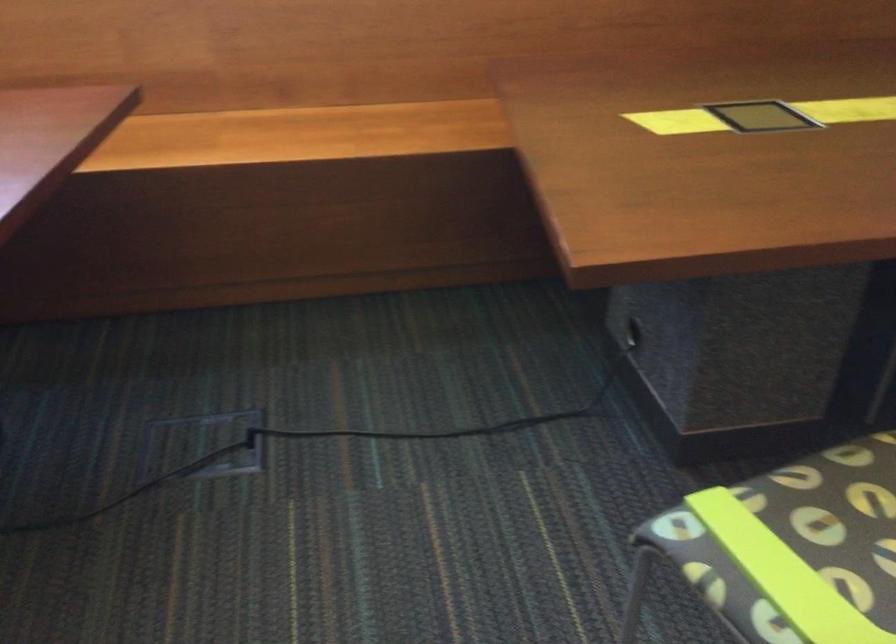
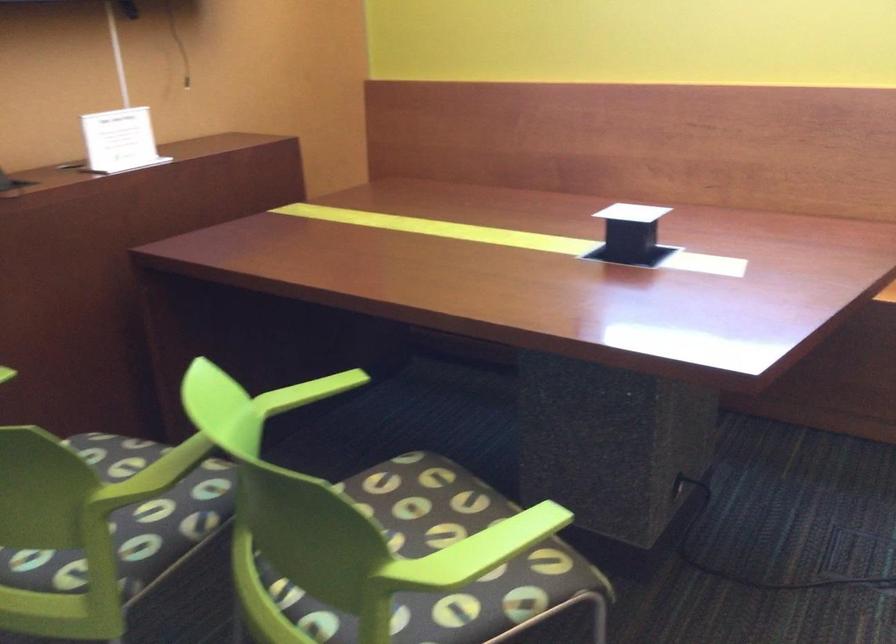
Question: Based on the continuous images, in which direction is the camera rotating? Reply with the corresponding letter.

Choices:
 (A) Left
 (B) Right
 (C) Up
 (D) Down

Answer: (A)